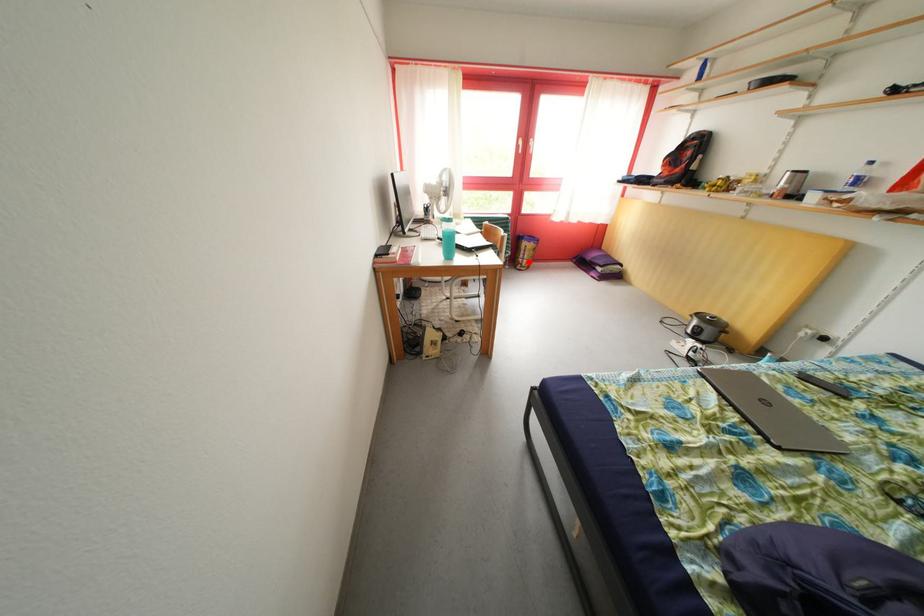
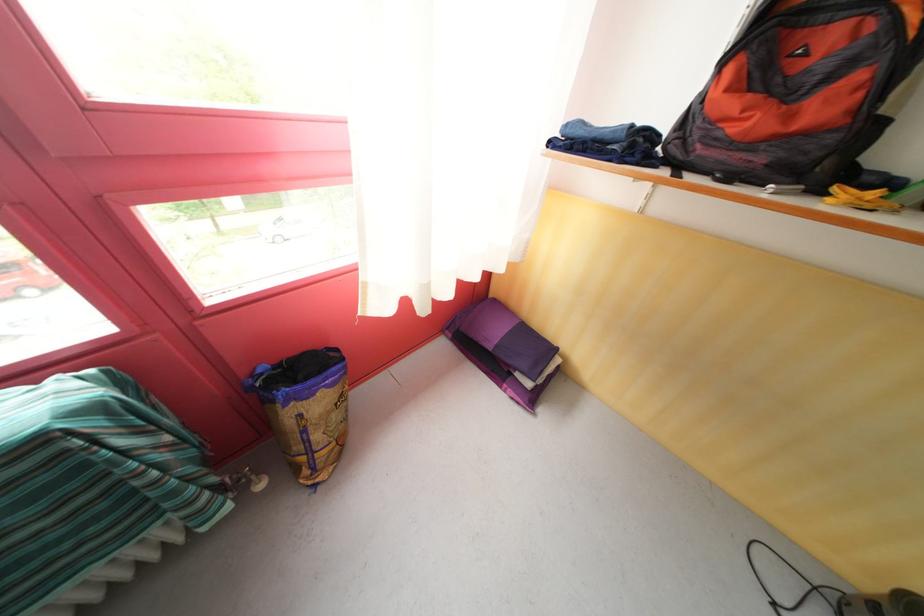
Question: I am providing you with two images of the same scene from different viewpoints. Given a red point in image1, look at the same physical point in image2. Is it:

Choices:
 (A) Closer to the viewpoint
 (B) Farther from the viewpoint

Answer: (B)